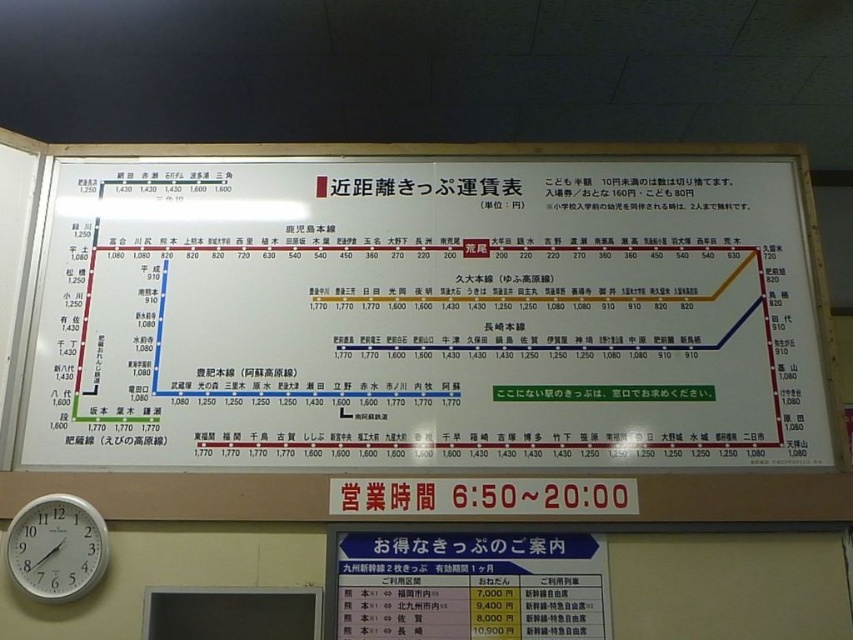
Question: Is white paper at center positioned at the back of matte plastic signboard at center?

Choices:
 (A) yes
 (B) no

Answer: (A)

Question: Estimate the real-world distances between objects in this image. Which object is closer to the white plastic clock at lower left?

Choices:
 (A) matte plastic signboard at center
 (B) white paper at center

Answer: (A)

Question: Can you confirm if white paper at center is thinner than white plastic clock at lower left?

Choices:
 (A) yes
 (B) no

Answer: (B)

Question: Which of the following is the closest to the observer?

Choices:
 (A) (457, 602)
 (B) (107, 547)
 (C) (252, 188)

Answer: (A)

Question: Does white paper at center appear under matte plastic signboard at center?

Choices:
 (A) yes
 (B) no

Answer: (B)

Question: Estimate the real-world distances between objects in this image. Which object is farther from the white plastic clock at lower left?

Choices:
 (A) white paper at center
 (B) matte plastic signboard at center

Answer: (A)